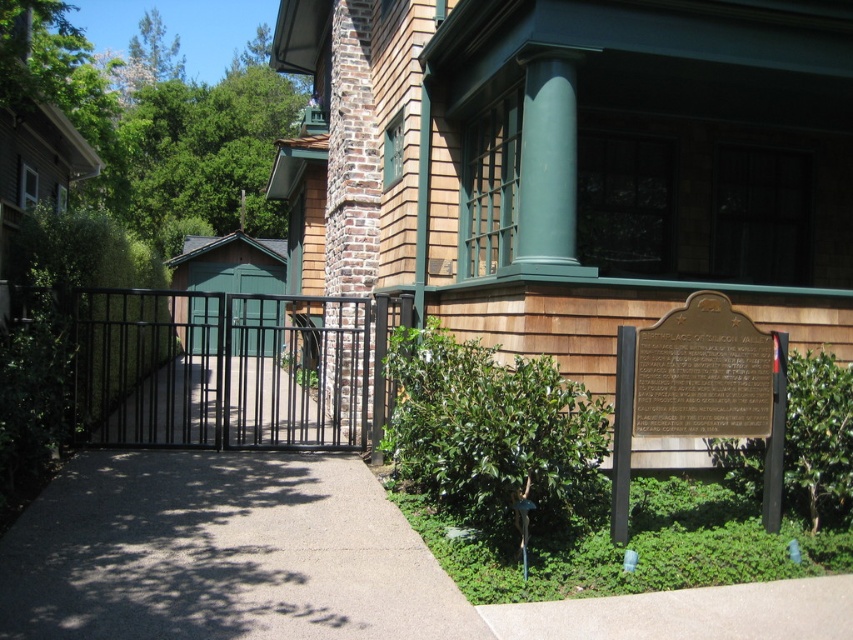
You are a tour guide leading a group to the historic building. The group wants to enter through the gates. The path between the black metal gate at center and the green wood gate at center is 8.59 meters. If your tour group is 10 meters long, will they be able to pass through the gates without bending or moving in a single file?

The distance between the black metal gate at center and the green wood gate at center is 8.59 meters. Since the tour group is 10 meters long, they will not be able to pass through the gates without bending or moving in a single file as the path is shorter than the group length.

From the picture: You are standing at the entrance of the historic building and want to walk directly to the gray concrete pavement at center. Which direction should you head?

Since the gray concrete pavement at center is located at point (221, 554), you should head towards the center of the image where the coordinates are located.